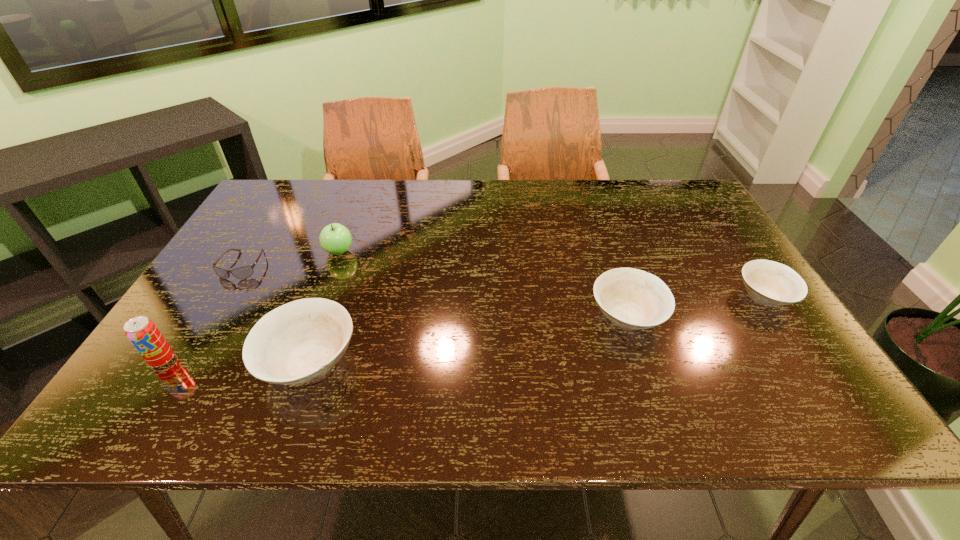
Identify the location of vacant space located on the left of the rightmost object. (654, 296).

Identify the location of vacant space located 0.270m on the left of the apple. Image resolution: width=960 pixels, height=540 pixels. coord(229,252).

Where is `vacant space located on the lenses of the shortest object`? vacant space located on the lenses of the shortest object is located at coordinates (204, 329).

Image resolution: width=960 pixels, height=540 pixels. Identify the location of vacant space located 0.140m on the back of the soda can. (198, 306).

Where is `bowl situated at the near edge`? The width and height of the screenshot is (960, 540). bowl situated at the near edge is located at coordinates (298, 342).

At what (x,y) coordinates should I click in order to perform the action: click on soda can present at the near edge. Please return your answer as a coordinate pair (x, y). The width and height of the screenshot is (960, 540). Looking at the image, I should click on (143, 334).

The image size is (960, 540). Identify the location of sunglasses located at the left edge. (244, 272).

Locate an element on the screen. This screenshot has height=540, width=960. soda can that is at the left edge is located at coordinates (143, 334).

Identify the location of object that is at the right edge. (768, 282).

Where is `object present at the near left corner`? The image size is (960, 540). object present at the near left corner is located at coordinates (143, 334).